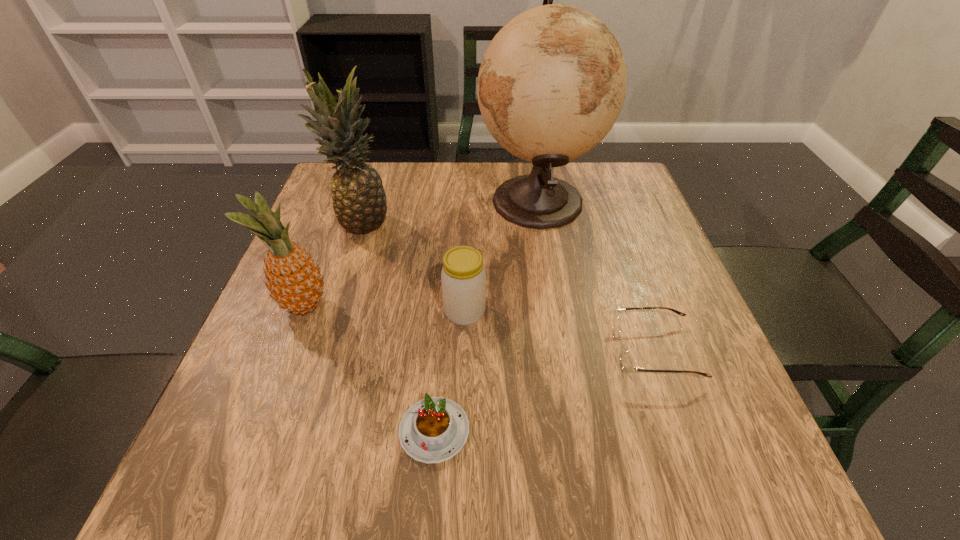
Find the location of a particular element. This screenshot has width=960, height=540. vacant space at the far left corner of the desktop is located at coordinates (328, 191).

You are a GUI agent. You are given a task and a screenshot of the screen. Output one action in this format:
    pyautogui.click(x=<x>, y=<y>)
    Task: Click on the free space at the far right corner of the desktop
    This screenshot has width=960, height=540.
    Given the screenshot: What is the action you would take?
    pyautogui.click(x=573, y=164)

I want to click on empty space between the tallest object and the shorter pineapple, so click(420, 253).

Image resolution: width=960 pixels, height=540 pixels. Identify the location of vacant area between the shorter pineapple and the tallest object. (420, 253).

In order to click on unoccupied position between the pudding and the globe in this screenshot , I will do tap(486, 315).

You are a GUI agent. You are given a task and a screenshot of the screen. Output one action in this format:
    pyautogui.click(x=<x>, y=<y>)
    Task: Click on the free space between the fourth tallest object and the farther pineapple
    
    Given the screenshot: What is the action you would take?
    pyautogui.click(x=414, y=267)

This screenshot has height=540, width=960. Find the location of `vacant area that lies between the spectacles and the third tallest object`. vacant area that lies between the spectacles and the third tallest object is located at coordinates (479, 329).

Locate an element on the screen. free area in between the nearest object and the fourth tallest object is located at coordinates (449, 372).

Identify the location of free spot between the third tallest object and the jar. This screenshot has width=960, height=540. (384, 309).

Where is `free space between the tallest object and the spectacles`? This screenshot has height=540, width=960. free space between the tallest object and the spectacles is located at coordinates (596, 276).